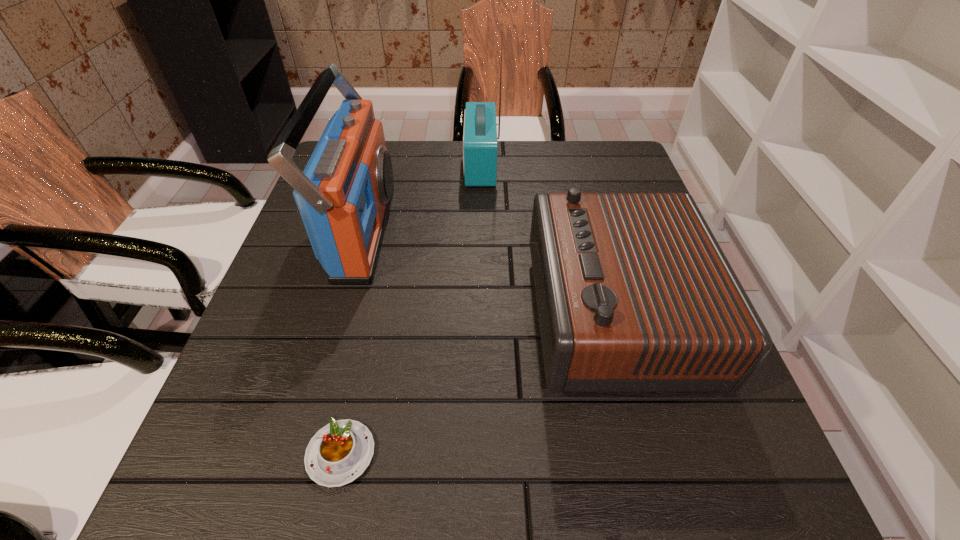
Find the location of a particular element. The height and width of the screenshot is (540, 960). object that stands as the second closest to the second radio receiver from right to left is located at coordinates (634, 294).

Identify which object is located as the third nearest to the rightmost object. Please provide its 2D coordinates. Your answer should be formatted as a tuple, i.e. [(x, y)], where the tuple contains the x and y coordinates of a point satisfying the conditions above.

[(344, 194)]

The width and height of the screenshot is (960, 540). Identify the location of radio receiver that is the second closest one to the second shortest object. (344, 194).

Choose which radio receiver is the third nearest neighbor to the pudding. Please provide its 2D coordinates. Your answer should be formatted as a tuple, i.e. [(x, y)], where the tuple contains the x and y coordinates of a point satisfying the conditions above.

[(479, 150)]

I want to click on free location that satisfies the following two spatial constraints: 1. on the front panel of the second radio receiver from left to right; 2. on the front side of the shortest object, so click(480, 454).

The height and width of the screenshot is (540, 960). I want to click on free point that satisfies the following two spatial constraints: 1. on the front-facing side of the leftmost radio receiver; 2. on the left side of the shortest object, so click(300, 454).

In order to click on vacant point that satisfies the following two spatial constraints: 1. on the tuning display of the rightmost radio receiver; 2. on the front side of the pudding in this screenshot , I will do `click(649, 454)`.

I want to click on free region that satisfies the following two spatial constraints: 1. on the front-facing side of the leftmost radio receiver; 2. on the right side of the shortest object, so click(300, 454).